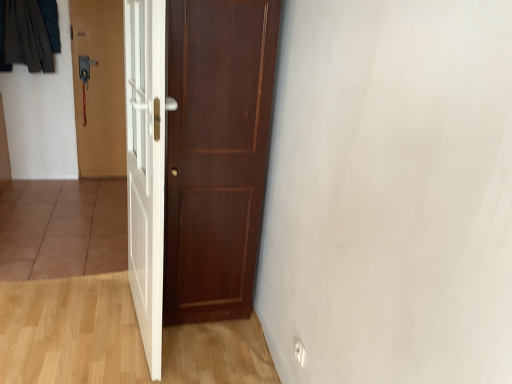
The height and width of the screenshot is (384, 512). Find the location of `vacant area that lies to the right of white glossy door at center, which is the first door from front to back`. vacant area that lies to the right of white glossy door at center, which is the first door from front to back is located at coordinates (214, 351).